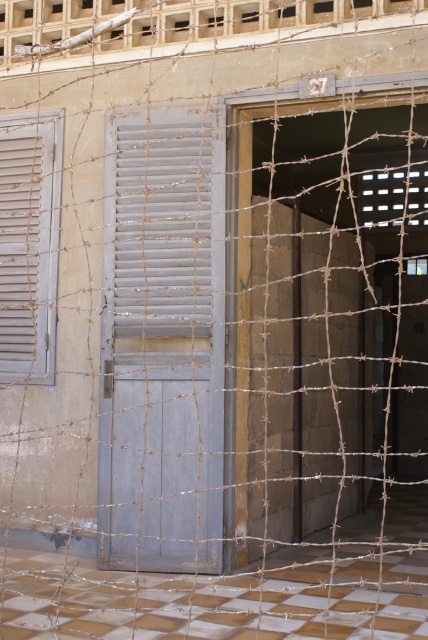
You are standing in front of the building and notice a specific point marked at coordinates (163, 230). What object is located exactly at that point?

The white matte shutter at center is located exactly at point (163, 230).

You are a delivery person trying to access the building through the gray matte door at center. The light gray wooden shutter at left is blocking part of the doorway. Can you pass through the doorway without removing the shutter?

The gray matte door at center has a larger size compared to light gray wooden shutter at left, so there might still be enough space to pass through the doorway even with the shutter blocking part of it.

You are standing in front of a building with a door partially hidden by barbed wire. You notice a specific point at coordinates (x=163, y=340). What object does this point correspond to?

The point at coordinates (x=163, y=340) corresponds to the gray matte door at center.